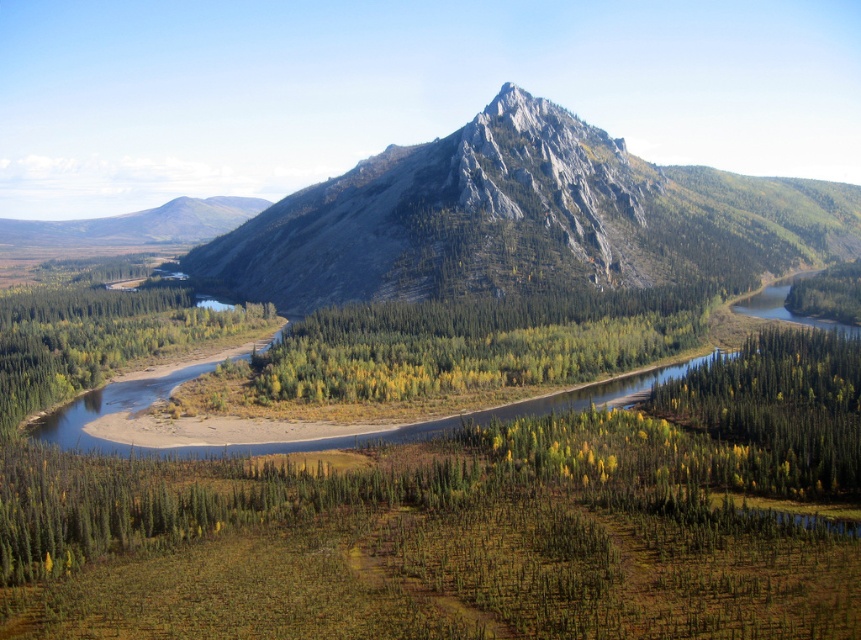
Does green leafy forest at center have a smaller size compared to green matte tree at lower right?

No, green leafy forest at center is not smaller than green matte tree at lower right.

Locate an element on the screen. Image resolution: width=861 pixels, height=640 pixels. green leafy forest at center is located at coordinates (479, 342).

At what (x,y) coordinates should I click in order to perform the action: click on green leafy forest at center. Please return your answer as a coordinate pair (x, y). Looking at the image, I should click on (479, 342).

Is point (847, 228) in front of point (807, 340)?

That is False.

Which is in front, point (704, 273) or point (722, 388)?

Positioned in front is point (722, 388).

Locate an element on the screen. rugged gray rock at center is located at coordinates (523, 220).

Is rugged gray rock at center wider than green leafy forest at center?

Yes, rugged gray rock at center is wider than green leafy forest at center.

Is rugged gray rock at center thinner than green leafy forest at center?

Incorrect, rugged gray rock at center's width is not less than green leafy forest at center's.

Which is in front, point (694, 259) or point (474, 304)?

Point (474, 304) is in front.

Find the location of a particular element. rugged gray rock at center is located at coordinates (523, 220).